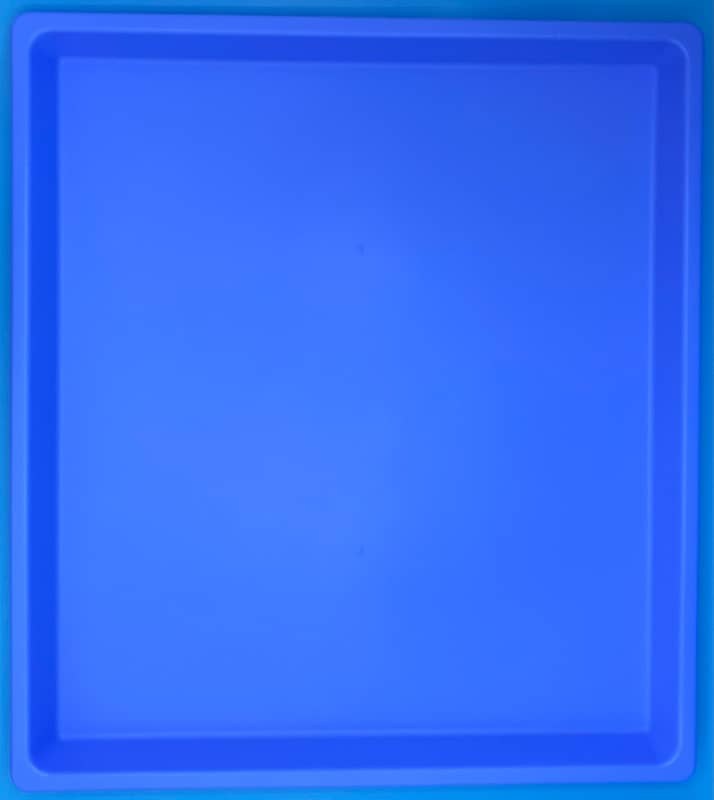
Find the location of a particular element. The height and width of the screenshot is (800, 714). four corners of the blue tray is located at coordinates tap(16, 12), tap(697, 26), tap(685, 780), tap(16, 786).